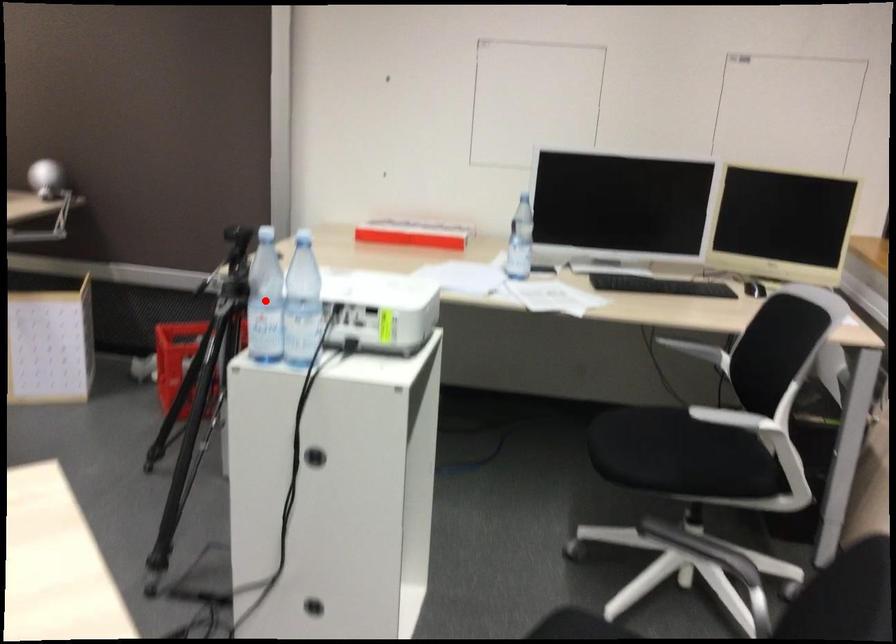
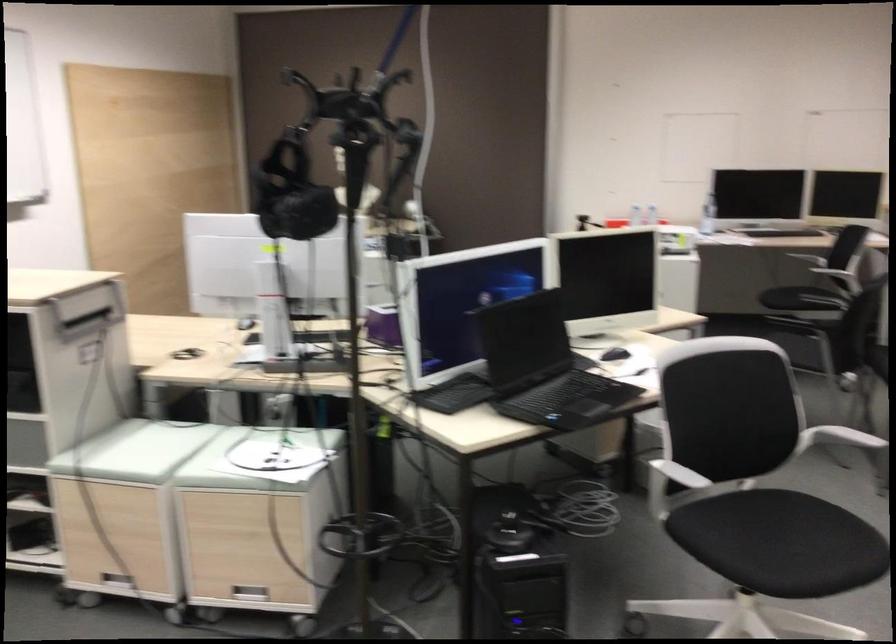
Question: I am providing you with two images of the same scene from different viewpoints. A red point is marked on the first image. Can you still see the location of the red point in image 2?

Choices:
 (A) Yes
 (B) No

Answer: (B)